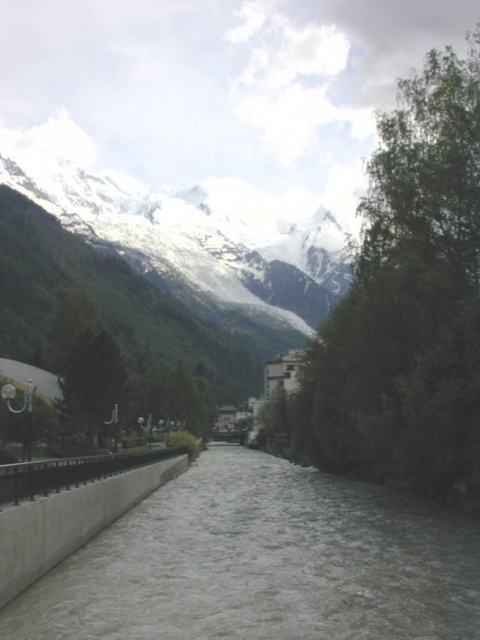
Is white concrete river at center below green leafy tree at upper right?

Yes.

In the scene shown: Does white concrete river at center lie in front of green leafy tree at upper right?

Yes, it is.

Who is more forward, (123, 525) or (332, 346)?

Positioned in front is point (123, 525).

Locate an element on the screen. The height and width of the screenshot is (640, 480). white concrete river at center is located at coordinates (264, 563).

Does white concrete river at center appear on the right side of green matte tree at center?

Yes, white concrete river at center is to the right of green matte tree at center.

Who is more distant from viewer, (31, 625) or (108, 419)?

The point (108, 419) is behind.

Image resolution: width=480 pixels, height=640 pixels. I want to click on white concrete river at center, so click(x=264, y=563).

Is green leafy tree at upper right thinner than green matte tree at center?

Incorrect, green leafy tree at upper right's width is not less than green matte tree at center's.

Does point (397, 184) come closer to viewer compared to point (93, 344)?

Yes, point (397, 184) is closer to viewer.

You are a GUI agent. You are given a task and a screenshot of the screen. Output one action in this format:
    pyautogui.click(x=<x>, y=<y>)
    Task: Click on the green leafy tree at upper right
    
    Given the screenshot: What is the action you would take?
    pyautogui.click(x=405, y=307)